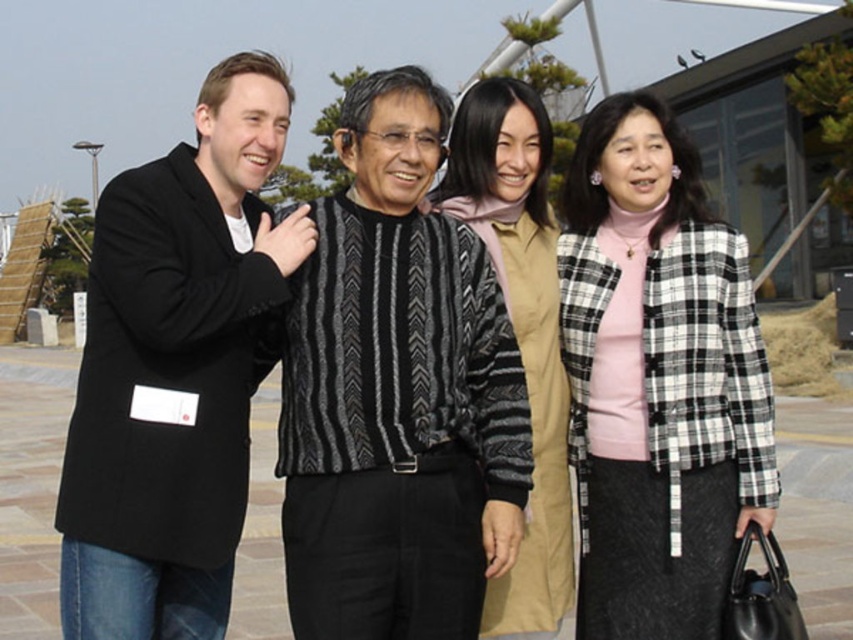
In the scene shown: You are a photographer trying to adjust the composition of the image. You want to ensure that both the checkered wool jacket at right and the beige textured cardigan at center are clearly visible. Based on their positions, which clothing item is closer to the camera?

The checkered wool jacket at right is positioned under the beige textured cardigan at center, so the beige textured cardigan at center is closer to the camera.